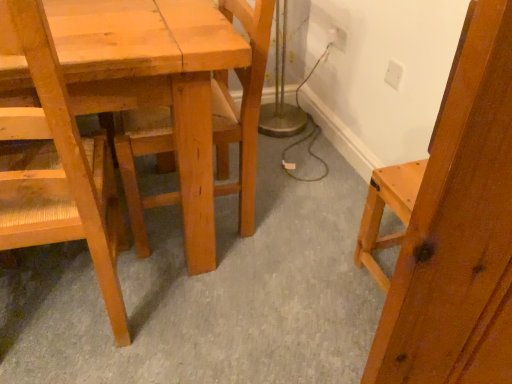
Question: From the image's perspective, is white plastic electric outlet at upper right, the 1th electric outlet from the left, above or below white plastic electric outlet at upper right, the 1th electric outlet from the front?

Choices:
 (A) below
 (B) above

Answer: (B)

Question: Considering the positions of white plastic electric outlet at upper right, which appears as the 2th electric outlet when ordered from the bottom, and white plastic electric outlet at upper right, the first electric outlet viewed from the right, in the image, is white plastic electric outlet at upper right, which appears as the 2th electric outlet when ordered from the bottom, taller or shorter than white plastic electric outlet at upper right, the first electric outlet viewed from the right,?

Choices:
 (A) short
 (B) tall

Answer: (A)

Question: Which object is the closest to the white plastic electric outlet at upper right, arranged as the 2th electric outlet when viewed from the left?

Choices:
 (A) white plastic electric outlet at upper right, the 1th electric outlet positioned from the back
 (B) natural wood chair at left, the second chair positioned from the right
 (C) natural wood chair at center, which is the second chair from left to right

Answer: (A)

Question: Which is farther from the white plastic electric outlet at upper right, positioned as the 1th electric outlet in top-to-bottom order?

Choices:
 (A) natural wood chair at left, the second chair positioned from the right
 (B) white plastic electric outlet at upper right, arranged as the 2th electric outlet when viewed from the left
 (C) natural wood chair at center, which is the second chair from left to right

Answer: (A)